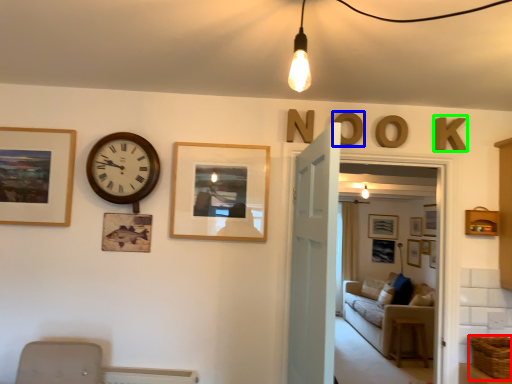
Question: Considering the real-world distances, which object is farthest from basket (highlighted by a red box)? letter (highlighted by a blue box) or letter (highlighted by a green box)?

Choices:
 (A) letter
 (B) letter

Answer: (A)